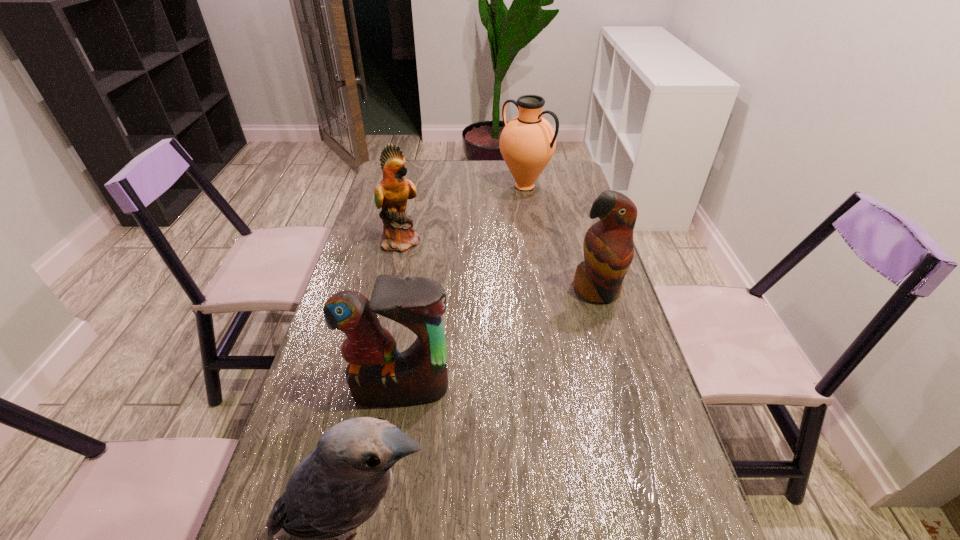
Where is `free space that is in between the pitcher and the fourth farthest object`? This screenshot has height=540, width=960. free space that is in between the pitcher and the fourth farthest object is located at coordinates (463, 288).

This screenshot has width=960, height=540. Identify the location of free space between the pitcher and the fourth nearest object. (464, 213).

Where is `free space between the farthest object and the third farthest parrot`? This screenshot has height=540, width=960. free space between the farthest object and the third farthest parrot is located at coordinates (463, 288).

Find the location of a particular element. This screenshot has height=540, width=960. free spot between the second nearest parrot and the pitcher is located at coordinates (463, 288).

The image size is (960, 540). Identify the location of unoccupied area between the second farthest object and the pitcher. (464, 213).

Where is `object that is the second closest to the farthest parrot`? This screenshot has width=960, height=540. object that is the second closest to the farthest parrot is located at coordinates (378, 374).

Where is `object identified as the closest to the farthest parrot`? Image resolution: width=960 pixels, height=540 pixels. object identified as the closest to the farthest parrot is located at coordinates (527, 143).

Point out which parrot is positioned as the nearest to the farthest object. Please provide its 2D coordinates. Your answer should be formatted as a tuple, i.e. [(x, y)], where the tuple contains the x and y coordinates of a point satisfying the conditions above.

[(391, 193)]

Identify the location of parrot object that ranks as the third closest to the farthest parrot. The height and width of the screenshot is (540, 960). (339, 486).